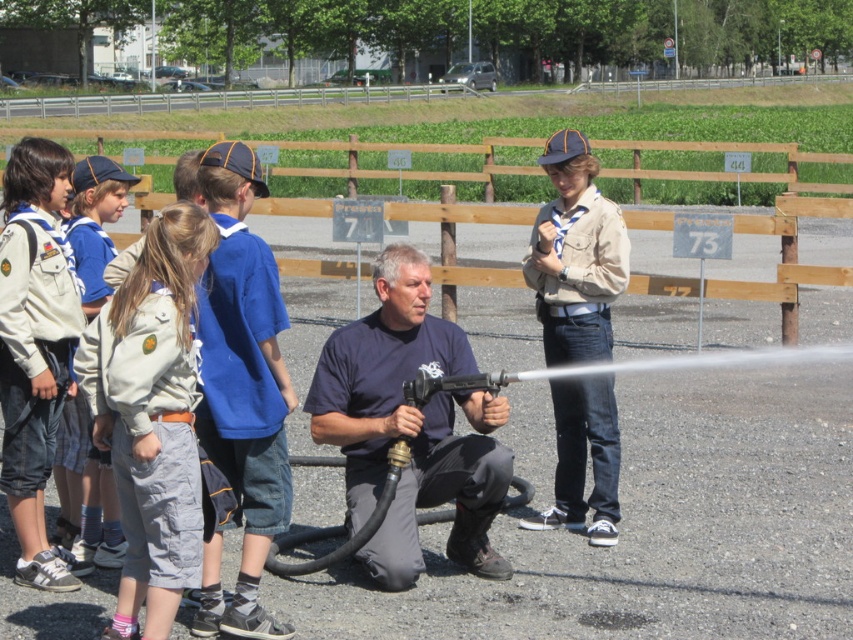
You are a photographer trying to capture the adult male in the center of the image. The adult is wearing a dark blue fabric shirt at center. Can you confirm if the point at coordinates (409, 426) is the center of his shirt?

Yes, the dark blue fabric shirt at center is represented by point (409, 426), so the point is indeed the center of his shirt.

You are a photographer trying to capture a photo of the dark blue fabric shirt at center and the blue cotton shirt at left. Since you want to focus on both subjects, which shirt should you position on the left side of your camera frame?

The blue cotton shirt at left should be positioned on the left side of your camera frame because the dark blue fabric shirt at center is to the right of it.